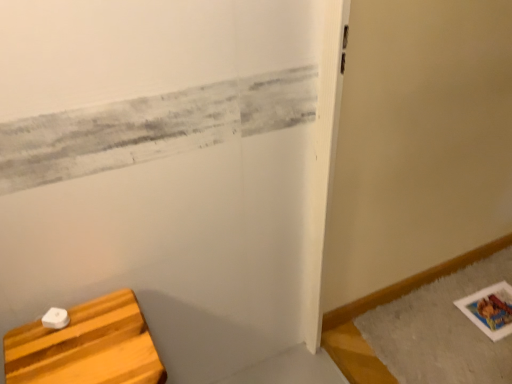
The height and width of the screenshot is (384, 512). I want to click on vacant point above white matte wood cutting board at lower left (from a real-world perspective), so click(95, 343).